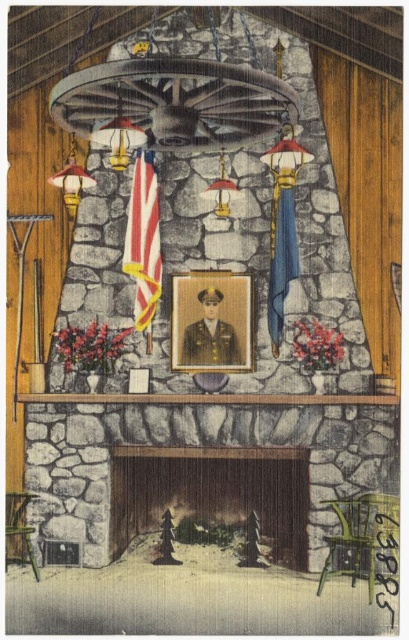
You are an interior designer planning to hang a new painting above the wooden fireplace at center. The painting is 1.5 meters wide. Can the smooth stone mantle at center accommodate the painting without overlapping the edges?

The smooth stone mantle at center is behind the wooden fireplace at center, so it cannot support a painting above the fireplace. Consider placing the painting elsewhere or using a different mounting solution.

Looking at this image, you are an interior designer planning to place a decorative item on the wooden fireplace at center and the smooth stone mantle at center. Which surface has a wider base to accommodate larger items?

The smooth stone mantle at center has a wider base than the wooden fireplace at center, so it can accommodate larger items.